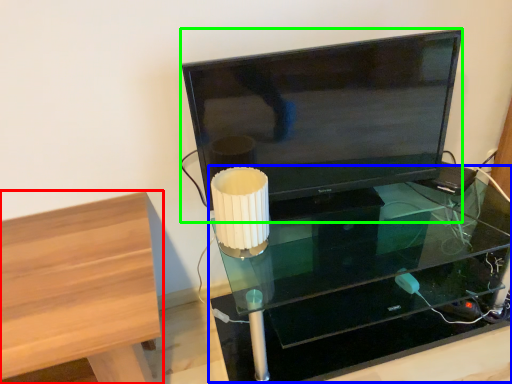
Question: Considering the real-world distances, which object is farthest from furniture (highlighted by a red box)? table (highlighted by a blue box) or television (highlighted by a green box)?

Choices:
 (A) table
 (B) television

Answer: (A)